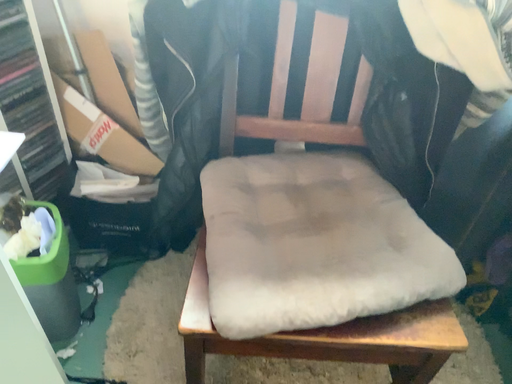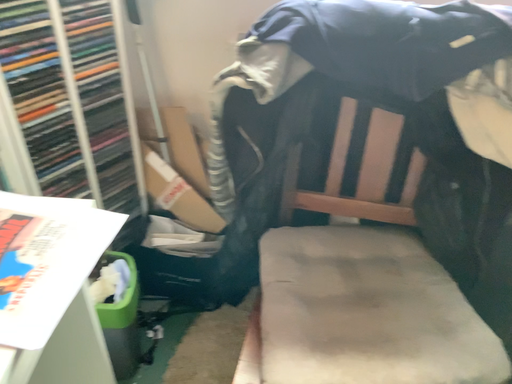
Question: How did the camera likely rotate when shooting the video?

Choices:
 (A) rotated upward
 (B) rotated downward

Answer: (A)